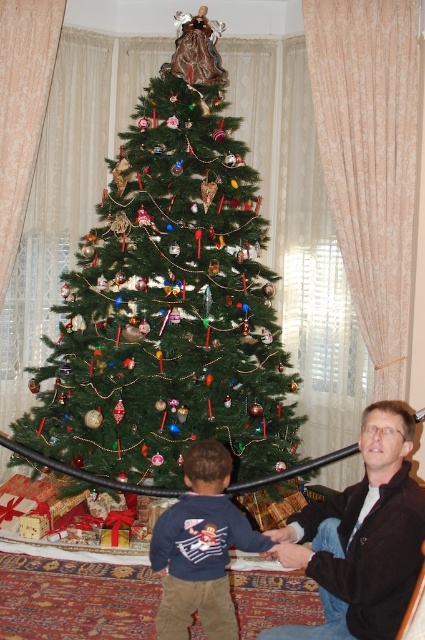
You are standing in front of the Christmas tree and see two points marked in the scene. The first point is labeled as point (215, 317) and the second is point (209, 460). Based on your observation, which point is closer to the tree?

Point (215, 317) is behind point (209, 460), so point (209, 460) is closer to the tree.

You are a parent trying to choose between placing a new gift under the Christmas tree for your child. The gift is 1.2 meters wide. There is space between the dark brown leather jacket at lower right and the dark blue sweater at lower center. Can the gift fit in that space?

The dark brown leather jacket at lower right is wider than the dark blue sweater at lower center. However, the exact width of the space between them isn